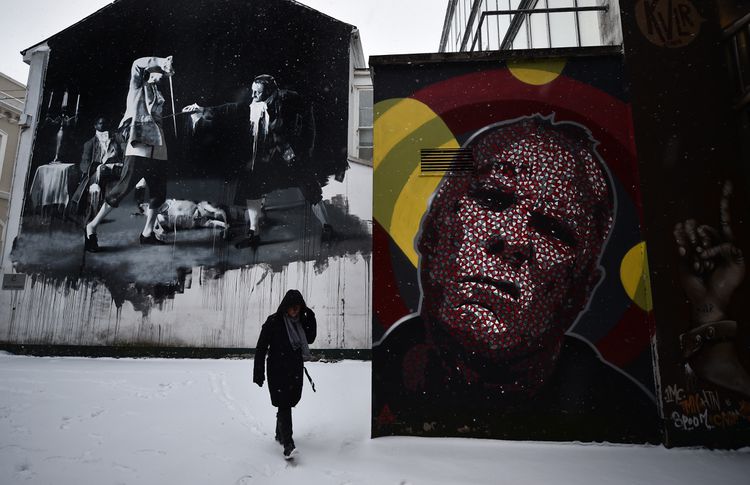
At what (x,y) coordinates should I click in order to perform the action: click on paintings on the wall. Please return your answer as a coordinate pair (x, y). Looking at the image, I should click on (150, 100), (526, 309), (694, 225).